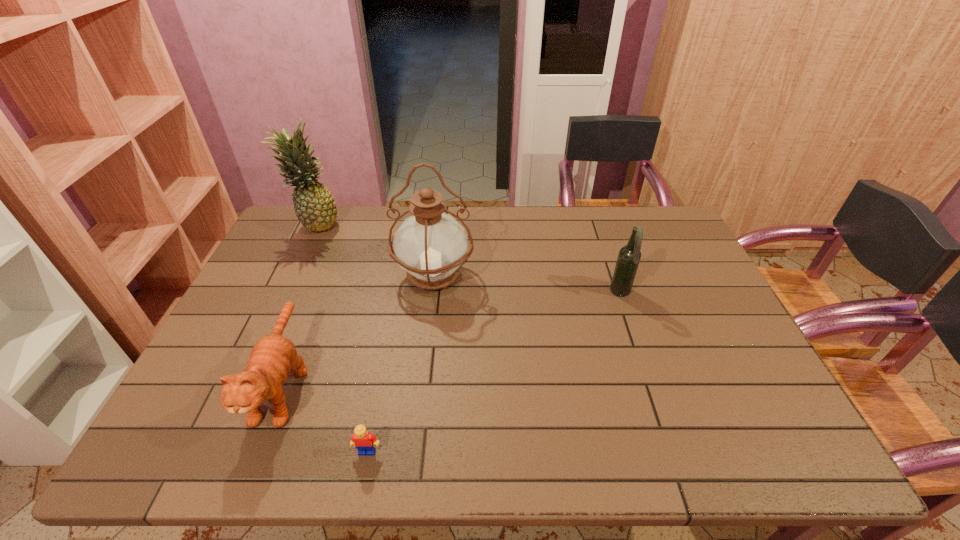
You are a GUI agent. You are given a task and a screenshot of the screen. Output one action in this format:
    pyautogui.click(x=<x>, y=<y>)
    Task: Click on the cat that is positioned at the near edge
    
    Given the screenshot: What is the action you would take?
    pyautogui.click(x=272, y=358)

This screenshot has width=960, height=540. I want to click on Lego that is at the near edge, so click(362, 439).

Locate an element on the screen. This screenshot has width=960, height=540. object that is positioned at the left edge is located at coordinates (314, 205).

Find the location of a particular element. The image size is (960, 540). object that is positioned at the far left corner is located at coordinates (314, 205).

Find the location of a particular element. The width and height of the screenshot is (960, 540). free point at the far edge is located at coordinates (471, 220).

In the image, there is a desktop. Where is `free region at the near edge`? free region at the near edge is located at coordinates (660, 448).

Where is `free space at the left edge`? The width and height of the screenshot is (960, 540). free space at the left edge is located at coordinates (247, 308).

At what (x,y) coordinates should I click in order to perform the action: click on blank space at the right edge of the desktop. Please return your answer as a coordinate pair (x, y). The image size is (960, 540). Looking at the image, I should click on (729, 372).

The height and width of the screenshot is (540, 960). In the image, there is a desktop. What are the coordinates of `free space at the far right corner` in the screenshot? It's located at (652, 240).

The image size is (960, 540). I want to click on free spot between the oil lamp and the third shortest object, so tap(527, 284).